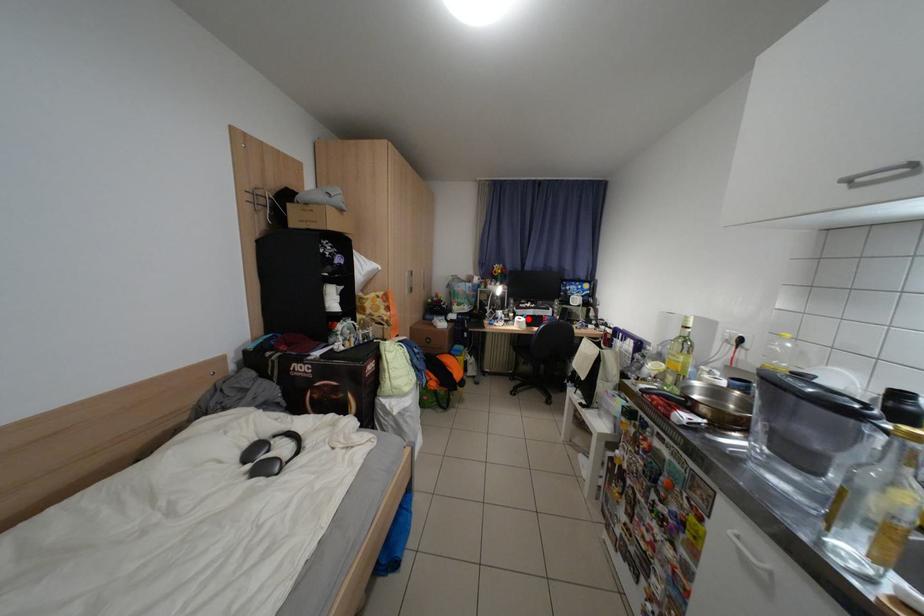
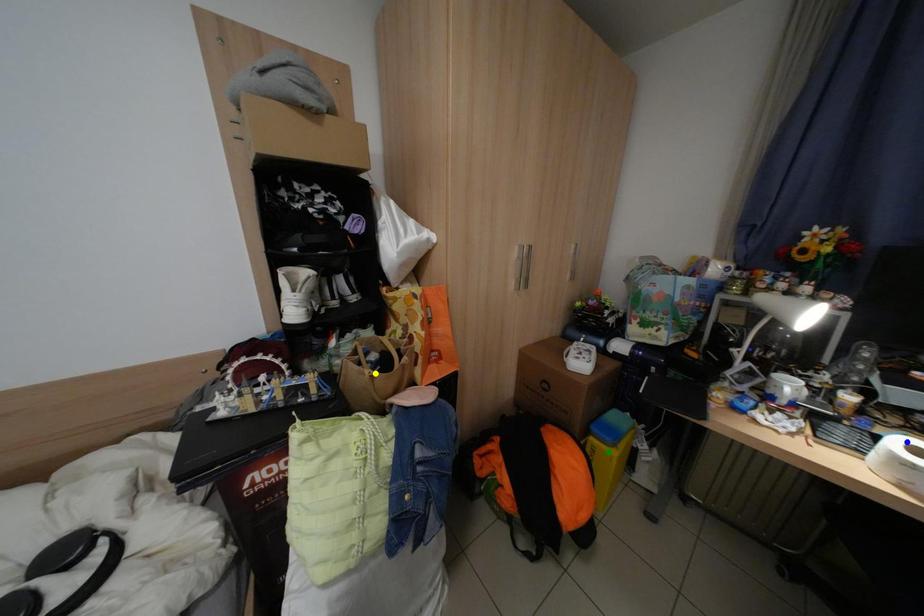
Question: I am providing you with two images of the same scene from different viewpoints. A red point is marked on the first image. You are given multiple points on the second image. Which point in image 2 is actually the same real-world point as the red point in image 1?

Choices:
 (A) yellow point
 (B) green point
 (C) blue point

Answer: (C)